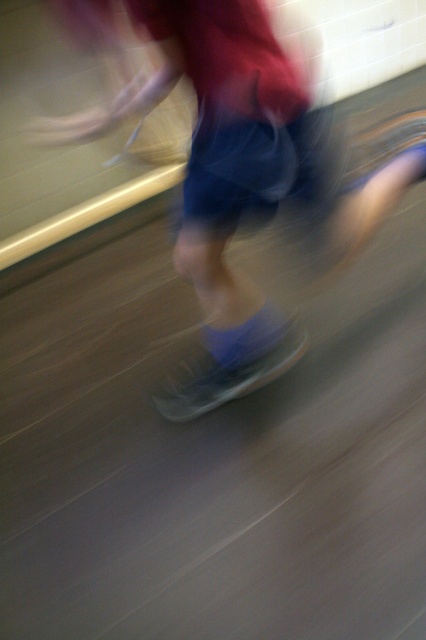
You are a drone operator trying to deliver a package to a point marked at point (66, 134). The delivery zone requires that the drone stays at least 1.5 meters away from any obstacles. Can you safely land the drone at the marked point?

The distance between the drone and the marked point is 1.39 meters, which is less than the required 1.5 meters safety distance. Therefore, it is not safe to land the drone at the marked point.

You are a photographer trying to capture a clear image of both the matte gray skateboard at center and the translucent plastic skateboard at center. Since the current image has motion blur, which skateboard should you focus on to ensure it appears sharp in your next shot?

The matte gray skateboard at center is to the right of the translucent plastic skateboard at center, so focusing on the translucent plastic skateboard at center would be better as it is closer to the center of the image where motion blur might be less severe.

Consider the image. You are standing in an indoor gym with a wooden floor and light colored tile walls. You see a point at coordinates (239,179). What object is located at that point?

The point at coordinates (239,179) indicates a matte gray skateboard at center.